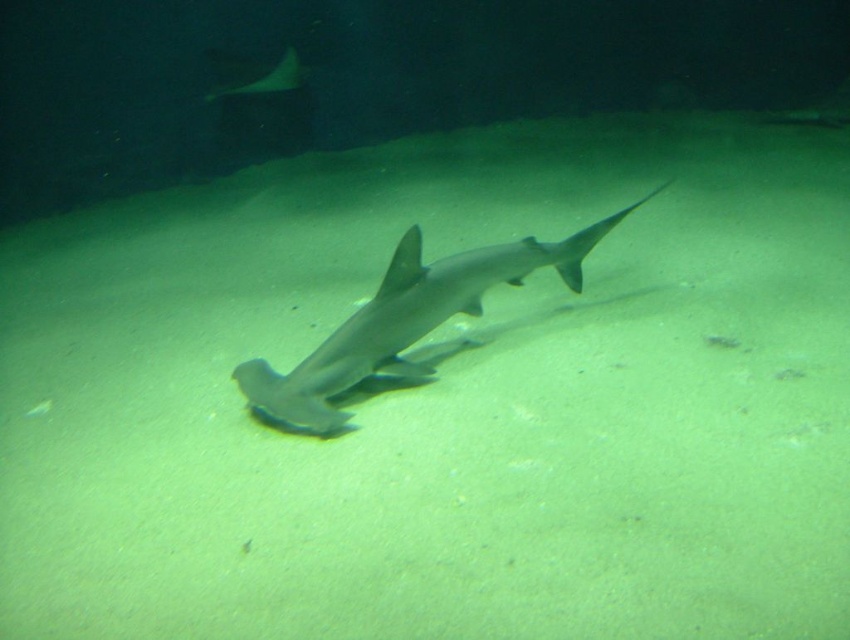
Find the location of a particular element. gray matte shark at center is located at coordinates (408, 321).

Which of these two, gray matte shark at center or smooth gray stingray at upper center, stands shorter?

With less height is smooth gray stingray at upper center.

Where is `gray matte shark at center`? The width and height of the screenshot is (850, 640). gray matte shark at center is located at coordinates coord(408,321).